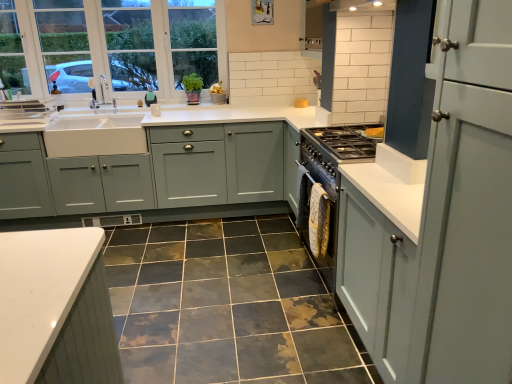
You are a GUI agent. You are given a task and a screenshot of the screen. Output one action in this format:
    pyautogui.click(x=<x>, y=<y>)
    Task: Click on the white ceramic sink at left
    
    Given the screenshot: What is the action you would take?
    pyautogui.click(x=95, y=134)

In order to face white ceramic sink at left, should I rotate leftwards or rightwards?

To face it directly, rotate left by 19.913 degrees.

What is the approximate height of white glass window at upper left?

It is 38.23 inches.

The image size is (512, 384). In order to click on matte gray cabinets at center, arranged as the 1th cabinetry when viewed from the left in this screenshot , I will do `click(157, 173)`.

Looking at this image, would you say matte gray cabinets at center, which appears as the second cabinetry when viewed from the front, is outside marble-like ceramic tile at center?

That's correct, matte gray cabinets at center, which appears as the second cabinetry when viewed from the front, is outside of marble-like ceramic tile at center.

Considering the positions of objects matte gray cabinets at center, which is the second cabinetry in right-to-left order, and marble-like ceramic tile at center in the image provided, who is more to the right, matte gray cabinets at center, which is the second cabinetry in right-to-left order, or marble-like ceramic tile at center?

marble-like ceramic tile at center.

Which object is closer to the camera, matte gray cabinets at center, arranged as the 1th cabinetry when viewed from the left, or marble-like ceramic tile at center?

marble-like ceramic tile at center is in front.

Is marble-like ceramic tile at center oriented away from white glass window at upper left?

marble-like ceramic tile at center is not turned away from white glass window at upper left.

Considering the points (219, 323) and (46, 73), which point is in front, point (219, 323) or point (46, 73)?

The point (219, 323) is closer to the camera.

This screenshot has height=384, width=512. What are the coordinates of `ceramic tile that appears below the white glass window at upper left (from a real-world perspective)` in the screenshot? It's located at (226, 306).

Is the position of marble-like ceramic tile at center more distant than that of white glass window at upper left?

No, it is in front of white glass window at upper left.

Looking at the image, does matte gray cabinets at center, arranged as the 1th cabinetry when viewed from the left, seem bigger or smaller compared to teal fabric at upper left?

Considering their sizes, matte gray cabinets at center, arranged as the 1th cabinetry when viewed from the left, takes up more space than teal fabric at upper left.

Is matte gray cabinets at center, the 1th cabinetry when ordered from back to front, not within teal fabric at upper left?

Yes, matte gray cabinets at center, the 1th cabinetry when ordered from back to front, is located beyond the bounds of teal fabric at upper left.

From a real-world perspective, between matte gray cabinets at center, the 1th cabinetry when ordered from back to front, and teal fabric at upper left, who is vertically lower?

matte gray cabinets at center, the 1th cabinetry when ordered from back to front, from a real-world perspective.

Is teal fabric at upper left in front of or behind marble-like ceramic tile at center in the image?

teal fabric at upper left is behind marble-like ceramic tile at center.

Can we say teal fabric at upper left lies outside marble-like ceramic tile at center?

Indeed, teal fabric at upper left is completely outside marble-like ceramic tile at center.

Looking at this image, are teal fabric at upper left and marble-like ceramic tile at center located far from each other?

Absolutely, teal fabric at upper left is distant from marble-like ceramic tile at center.

Looking at their sizes, would you say teal fabric at upper left is wider or thinner than marble-like ceramic tile at center?

→ Clearly, teal fabric at upper left has less width compared to marble-like ceramic tile at center.

Find the location of a particular element. Image resolution: width=512 pixels, height=384 pixels. ceramic tile that appears below the teal fabric at upper left (from the image's perspective) is located at coordinates (226, 306).

From a real-world perspective, is marble-like ceramic tile at center located beneath teal fabric at upper left?

Yes.

Does marble-like ceramic tile at center come behind teal fabric at upper left?

No, marble-like ceramic tile at center is closer to the camera.

Which object is positioned more to the left, marble-like ceramic tile at center or teal fabric at upper left?

teal fabric at upper left is more to the left.

Which of these two, white ceramic sink at left or white glass window at upper left, is wider?

white ceramic sink at left.

In the image, is white ceramic sink at left positioned in front of or behind white glass window at upper left?

Visually, white ceramic sink at left is located in front of white glass window at upper left.

From the image's perspective, is white ceramic sink at left on top of white glass window at upper left?

No, from the image's perspective, white ceramic sink at left is not over white glass window at upper left.

Is white ceramic sink at left outside of white glass window at upper left?

Yes, white ceramic sink at left is located beyond the bounds of white glass window at upper left.

How many degrees apart are the facing directions of matte gray cabinet at right, which is counted as the second cabinetry, starting from the left, and white glass window at upper left?

There is a 90.4-degree angle between the facing directions of matte gray cabinet at right, which is counted as the second cabinetry, starting from the left, and white glass window at upper left.

Between matte gray cabinet at right, which is the 1th cabinetry from front to back, and white glass window at upper left, which one has larger size?

Bigger between the two is matte gray cabinet at right, which is the 1th cabinetry from front to back.

From the image's perspective, relative to white glass window at upper left, is matte gray cabinet at right, which is counted as the second cabinetry, starting from the left, above or below?

matte gray cabinet at right, which is counted as the second cabinetry, starting from the left, is situated lower than white glass window at upper left in the image.

Which object is wider, matte gray cabinet at right, which is counted as the second cabinetry, starting from the left, or white glass window at upper left?

matte gray cabinet at right, which is counted as the second cabinetry, starting from the left.

Where is `cabinetry that is the 2nd one when counting upward from the marble-like ceramic tile at center (from the image's perspective)`? The height and width of the screenshot is (384, 512). cabinetry that is the 2nd one when counting upward from the marble-like ceramic tile at center (from the image's perspective) is located at coordinates (157, 173).

You are a GUI agent. You are given a task and a screenshot of the screen. Output one action in this format:
    pyautogui.click(x=<x>, y=<y>)
    Task: Click on the ceramic tile that is below the white glass window at upper left (from the image's perspective)
    The width and height of the screenshot is (512, 384).
    Given the screenshot: What is the action you would take?
    pyautogui.click(x=226, y=306)

Consider the image. Which object lies further to the anchor point marble-like ceramic tile at center, matte gray cabinets at center, the 1th cabinetry when ordered from back to front, or white glass window at upper left?

white glass window at upper left.

Looking at the image, which one is located further to white ceramic sink at left, white glass window at upper left or matte gray cabinets at center, arranged as the 1th cabinetry when viewed from the left?

Based on the image, white glass window at upper left appears to be further to white ceramic sink at left.

Which object lies further to the anchor point white ceramic sink at left, matte gray cabinet at right, which is counted as the 1th cabinetry, starting from the right, or marble-like ceramic tile at center?

matte gray cabinet at right, which is counted as the 1th cabinetry, starting from the right.

Estimate the real-world distances between objects in this image. Which object is further from teal fabric at upper left, white ceramic sink at left or matte gray cabinets at center, which appears as the second cabinetry when viewed from the front?

matte gray cabinets at center, which appears as the second cabinetry when viewed from the front, lies further to teal fabric at upper left than the other object.

From the image, which object appears to be nearer to white glass window at upper left, matte gray cabinets at center, arranged as the 1th cabinetry when viewed from the left, or white ceramic sink at left?

white ceramic sink at left is closer to white glass window at upper left.

Looking at the image, which one is located closer to matte gray cabinet at right, which is counted as the 1th cabinetry, starting from the right, white glass window at upper left or white ceramic sink at left?

white ceramic sink at left.

Considering their positions, is teal fabric at upper left positioned closer to matte gray cabinet at right, which is the 1th cabinetry from front to back, than white ceramic sink at left?

The object closer to matte gray cabinet at right, which is the 1th cabinetry from front to back, is white ceramic sink at left.

Estimate the real-world distances between objects in this image. Which object is closer to teal fabric at upper left, marble-like ceramic tile at center or matte gray cabinets at center, which appears as the second cabinetry when viewed from the front?

matte gray cabinets at center, which appears as the second cabinetry when viewed from the front, is closer to teal fabric at upper left.

This screenshot has height=384, width=512. I want to click on sink located between matte gray cabinets at center, which appears as the second cabinetry when viewed from the front, and teal fabric at upper left in the depth direction, so click(x=95, y=134).

The image size is (512, 384). I want to click on cabinetry between marble-like ceramic tile at center and teal fabric at upper left in the front-back direction, so click(x=157, y=173).

At what (x,y) coordinates should I click in order to perform the action: click on cabinetry positioned between matte gray cabinet at right, the second cabinetry positioned from the back, and teal fabric at upper left from near to far. Please return your answer as a coordinate pair (x, y). Image resolution: width=512 pixels, height=384 pixels. Looking at the image, I should click on (157, 173).

Where is `ceramic tile between matte gray cabinet at right, which is counted as the second cabinetry, starting from the left, and white glass window at upper left from front to back`? This screenshot has height=384, width=512. ceramic tile between matte gray cabinet at right, which is counted as the second cabinetry, starting from the left, and white glass window at upper left from front to back is located at coordinates (226, 306).